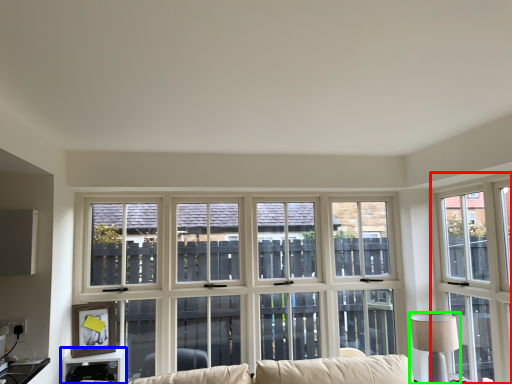
Question: Which object is the farthest from window (highlighted by a red box)? Choose among these: table (highlighted by a blue box) or table lamp (highlighted by a green box).

Choices:
 (A) table
 (B) table lamp

Answer: (A)